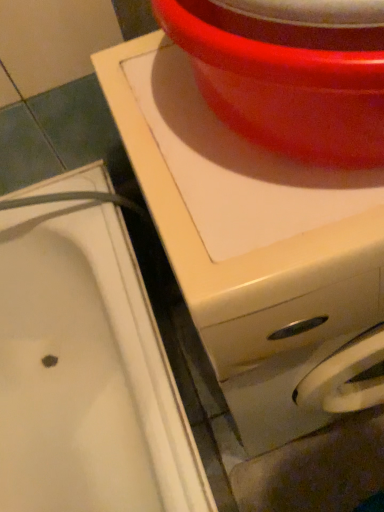
Question: Does white glossy sink at lower left have a lesser height compared to white glossy washing machine at upper center?

Choices:
 (A) yes
 (B) no

Answer: (A)

Question: Is white glossy washing machine at upper center at the back of white glossy sink at lower left?

Choices:
 (A) yes
 (B) no

Answer: (B)

Question: Is white glossy washing machine at upper center located within white glossy sink at lower left?

Choices:
 (A) yes
 (B) no

Answer: (B)

Question: From a real-world perspective, is white glossy sink at lower left located beneath white glossy washing machine at upper center?

Choices:
 (A) no
 (B) yes

Answer: (B)

Question: From the image's perspective, is white glossy sink at lower left on top of white glossy washing machine at upper center?

Choices:
 (A) yes
 (B) no

Answer: (B)

Question: Is white glossy sink at lower left in contact with white glossy washing machine at upper center?

Choices:
 (A) no
 (B) yes

Answer: (A)

Question: Is the depth of glossy plastic basin at upper center greater than that of white glossy sink at lower left?

Choices:
 (A) no
 (B) yes

Answer: (A)

Question: Is glossy plastic basin at upper center positioned beyond the bounds of white glossy sink at lower left?

Choices:
 (A) no
 (B) yes

Answer: (B)

Question: Can you confirm if glossy plastic basin at upper center is bigger than white glossy sink at lower left?

Choices:
 (A) no
 (B) yes

Answer: (A)

Question: From the image's perspective, is glossy plastic basin at upper center located above white glossy sink at lower left?

Choices:
 (A) no
 (B) yes

Answer: (B)

Question: Can you confirm if glossy plastic basin at upper center is thinner than white glossy sink at lower left?

Choices:
 (A) yes
 (B) no

Answer: (A)

Question: Considering the relative positions of glossy plastic basin at upper center and white glossy sink at lower left in the image provided, is glossy plastic basin at upper center to the right of white glossy sink at lower left from the viewer's perspective?

Choices:
 (A) no
 (B) yes

Answer: (B)

Question: Is white glossy sink at lower left behind glossy plastic basin at upper center?

Choices:
 (A) yes
 (B) no

Answer: (A)